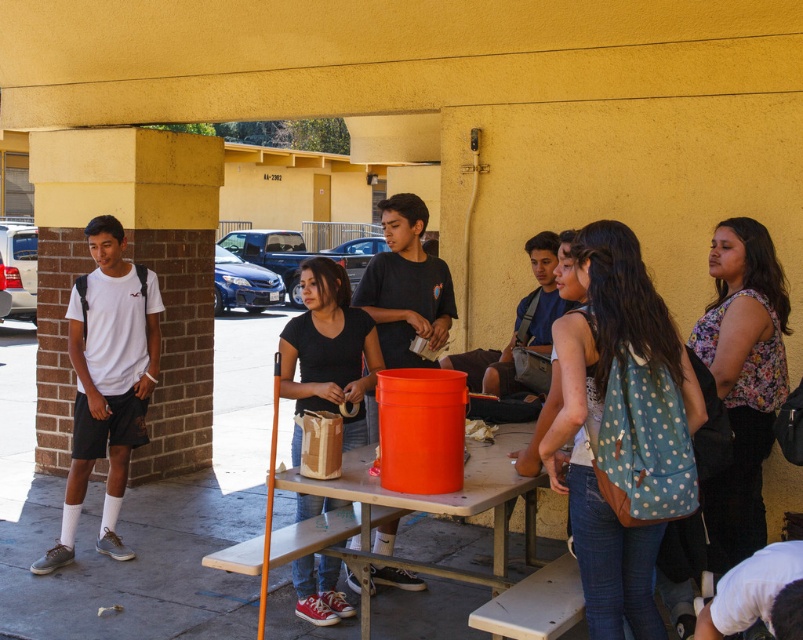
You are standing in the outdoor area and want to move from the picnic table to the brick column. Which point, point (373,557) or point (547,289), is closer to you as you start moving towards the column?

Point (373,557) is closer to the viewer than point (547,289), so it would be the closer point as you start moving towards the column.

You are standing at the entrance of the covered outdoor area and want to place a new bench. The bench requires a space of 1.2 meters in length. Can the wooden picnic table at center accommodate this bench next to it?

The wooden picnic table at center is located at point (414, 509). However, without specific spatial dimensions or orientation details about the table and available space, it is unclear if the bench will fit. More information is needed to determine this.